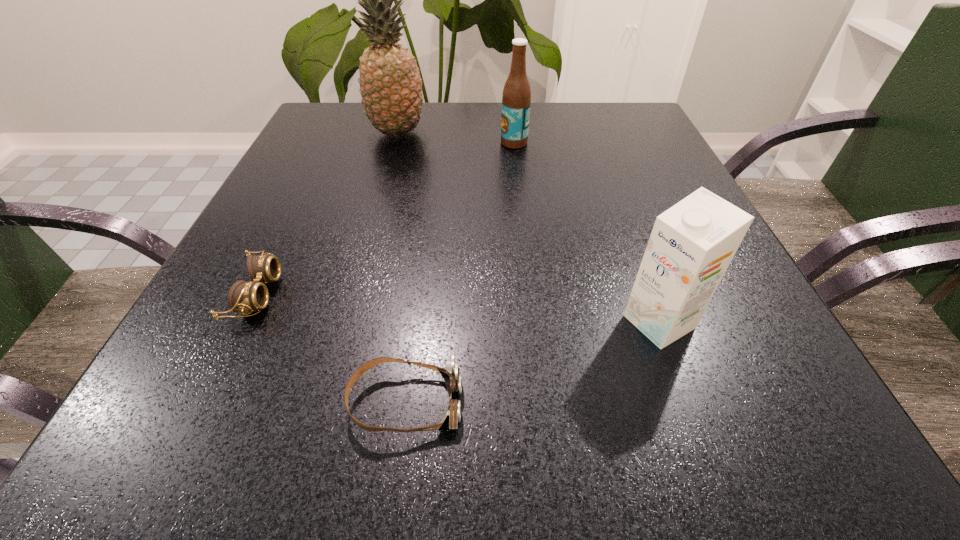
At what (x,y) coordinates should I click in order to perform the action: click on free space at the left edge. Please return your answer as a coordinate pair (x, y). Image resolution: width=960 pixels, height=540 pixels. Looking at the image, I should click on (333, 236).

The image size is (960, 540). In the image, there is a desktop. Find the location of `vacant space at the right edge`. vacant space at the right edge is located at coordinates (727, 387).

In the image, there is a desktop. At what (x,y) coordinates should I click in order to perform the action: click on vacant space at the far left corner. Please return your answer as a coordinate pair (x, y). Image resolution: width=960 pixels, height=540 pixels. Looking at the image, I should click on coord(350,110).

Locate an element on the screen. This screenshot has width=960, height=540. free space at the near left corner of the desktop is located at coordinates (262, 418).

The width and height of the screenshot is (960, 540). What are the coordinates of `free space at the far right corner of the desktop` in the screenshot? It's located at (623, 144).

Locate an element on the screen. The width and height of the screenshot is (960, 540). vacant space that is in between the rightmost object and the pineapple is located at coordinates (528, 227).

Where is `free space between the nearer goggles and the fourth object from left to right`? The height and width of the screenshot is (540, 960). free space between the nearer goggles and the fourth object from left to right is located at coordinates (460, 273).

Identify the location of vacant space that is in between the right goggles and the carton. (532, 362).

I want to click on empty space that is in between the leftmost object and the rightmost object, so click(x=458, y=308).

Locate an element on the screen. The image size is (960, 540). empty space that is in between the carton and the nearer goggles is located at coordinates (532, 362).